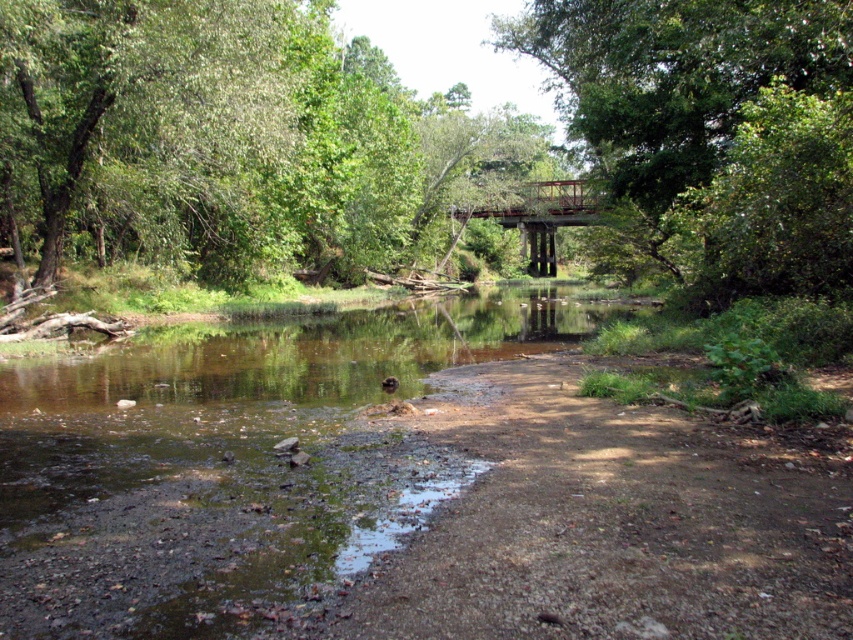
Question: Does brown/muddy water at center have a greater width compared to rusty metal bridge at center?

Choices:
 (A) yes
 (B) no

Answer: (A)

Question: Is green leafy tree at upper center further to the viewer compared to rusty metal bridge at center?

Choices:
 (A) no
 (B) yes

Answer: (A)

Question: Does brown/muddy water at center appear on the right side of green leafy tree at upper center?

Choices:
 (A) yes
 (B) no

Answer: (B)

Question: Which point is closer to the camera?

Choices:
 (A) brown/muddy water at center
 (B) green leafy tree at upper center
 (C) rusty metal bridge at center

Answer: (A)

Question: Among these points, which one is nearest to the camera?

Choices:
 (A) (824, 198)
 (B) (183, 424)

Answer: (B)

Question: Which object is farther from the camera taking this photo?

Choices:
 (A) green leafy tree at upper center
 (B) brown/muddy water at center
 (C) rusty metal bridge at center

Answer: (C)